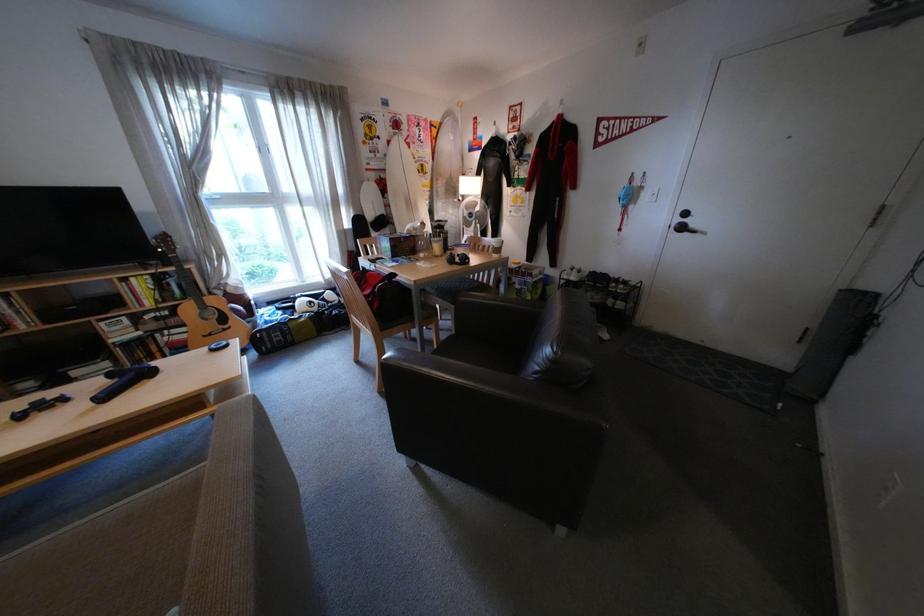
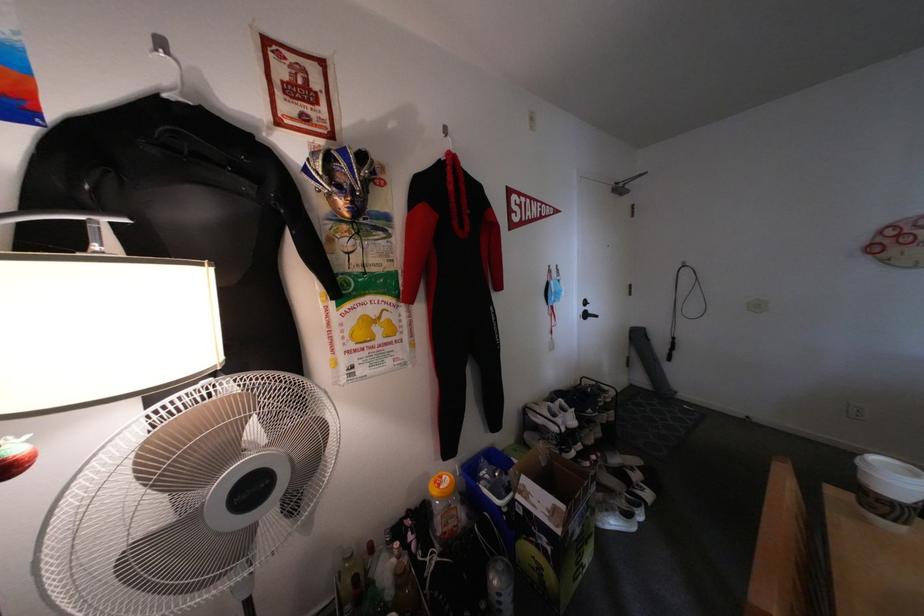
Locate, in the second image, the point that corresponds to point 542,164 in the first image.

(404, 237)